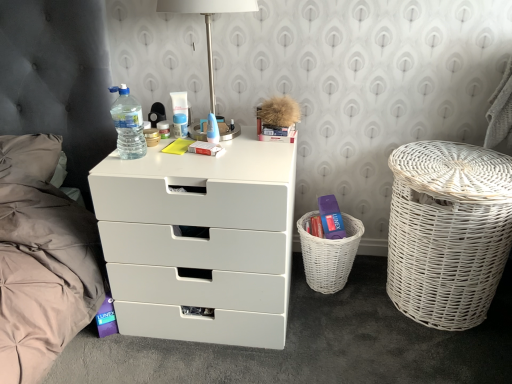
I want to click on white wicker basket at lower right, so click(x=329, y=254).

What do you see at coordinates (40, 263) in the screenshot?
I see `dark grey tufted headboard at left` at bounding box center [40, 263].

The height and width of the screenshot is (384, 512). What do you see at coordinates (448, 231) in the screenshot?
I see `white wicker laundry basket at right` at bounding box center [448, 231].

The height and width of the screenshot is (384, 512). Find the location of `translucent plastic tube at center, which is the third toiletry in right-to-left order`. translucent plastic tube at center, which is the third toiletry in right-to-left order is located at coordinates (164, 129).

Is point (187, 135) farther from viewer compared to point (455, 186)?

That is True.

Would you say white wicker laundry basket at right is part of blue plastic container at center, arranged as the third toiletry when viewed from the left,'s contents?

That's incorrect, white wicker laundry basket at right is not inside blue plastic container at center, arranged as the third toiletry when viewed from the left.

Which object is thinner, blue plastic container at center, arranged as the third toiletry when viewed from the left, or white wicker laundry basket at right?

blue plastic container at center, arranged as the third toiletry when viewed from the left, is thinner.

Is blue plastic container at center, the 1th toiletry when ordered from right to left, in contact with white wicker laundry basket at right?

There is a gap between blue plastic container at center, the 1th toiletry when ordered from right to left, and white wicker laundry basket at right.

Looking at this image, from a real-world perspective, between translucent plastic tube at center, the first toiletry in the left-to-right sequence, and dark grey tufted headboard at left, who is vertically higher?

translucent plastic tube at center, the first toiletry in the left-to-right sequence.

Is translucent plastic tube at center, which is the third toiletry in right-to-left order, not within dark grey tufted headboard at left?

Yes.

Is translucent plastic tube at center, which is the third toiletry in right-to-left order, looking in the opposite direction of dark grey tufted headboard at left?

No, dark grey tufted headboard at left is not at the back of translucent plastic tube at center, which is the third toiletry in right-to-left order.

Can you confirm if translucent plastic tube at center, which is the third toiletry in right-to-left order, is positioned to the left of dark grey tufted headboard at left?

Incorrect, translucent plastic tube at center, which is the third toiletry in right-to-left order, is not on the left side of dark grey tufted headboard at left.

Based on their sizes in the image, would you say satin nickel table lamp at upper center is bigger or smaller than blue plastic container at center, the 1th toiletry when ordered from right to left?

In the image, satin nickel table lamp at upper center appears to be larger than blue plastic container at center, the 1th toiletry when ordered from right to left.

Who is taller, satin nickel table lamp at upper center or blue plastic container at center, the 1th toiletry when ordered from right to left?

Standing taller between the two is satin nickel table lamp at upper center.

In terms of width, does satin nickel table lamp at upper center look wider or thinner when compared to blue plastic container at center, arranged as the third toiletry when viewed from the left?

In the image, satin nickel table lamp at upper center appears to be wider than blue plastic container at center, arranged as the third toiletry when viewed from the left.

Is satin nickel table lamp at upper center further to the viewer compared to translucent plastic bottle at upper left?

No.

Is satin nickel table lamp at upper center far away from translucent plastic bottle at upper left?

Actually, satin nickel table lamp at upper center and translucent plastic bottle at upper left are a little close together.

Is point (211, 66) positioned before point (132, 114)?

Yes, it is in front of point (132, 114).

Does satin nickel table lamp at upper center have a greater height compared to translucent plastic bottle at upper left?

Indeed, satin nickel table lamp at upper center has a greater height compared to translucent plastic bottle at upper left.

In the scene shown: Who is bigger, translucent plastic cream at center, acting as the second toiletry starting from the left, or blue plastic container at center, the 1th toiletry when ordered from right to left?

translucent plastic cream at center, acting as the second toiletry starting from the left.

Can you confirm if translucent plastic cream at center, which is counted as the second toiletry, starting from the right, is taller than blue plastic container at center, the 1th toiletry when ordered from right to left?

Indeed, translucent plastic cream at center, which is counted as the second toiletry, starting from the right, has a greater height compared to blue plastic container at center, the 1th toiletry when ordered from right to left.

Which point is more forward, (179, 102) or (180, 119)?

The point (180, 119) is closer to the camera.

Is white wicker basket at lower right not near white matte chest of drawers at center?

No.

From a real-world perspective, which object rests below the other?

From a 3D spatial view, white wicker basket at lower right is below.

Is white wicker basket at lower right bigger or smaller than white matte chest of drawers at center?

white wicker basket at lower right is smaller than white matte chest of drawers at center.

Is dark grey tufted headboard at left taller than translucent plastic cream at center, acting as the second toiletry starting from the left?

Yes, dark grey tufted headboard at left is taller than translucent plastic cream at center, acting as the second toiletry starting from the left.

Considering the sizes of dark grey tufted headboard at left and translucent plastic cream at center, which is counted as the second toiletry, starting from the right, in the image, is dark grey tufted headboard at left wider or thinner than translucent plastic cream at center, which is counted as the second toiletry, starting from the right,?

Clearly, dark grey tufted headboard at left has more width compared to translucent plastic cream at center, which is counted as the second toiletry, starting from the right.

Is dark grey tufted headboard at left behind translucent plastic cream at center, which is counted as the second toiletry, starting from the right?

No, dark grey tufted headboard at left is closer to the viewer.

Is point (32, 260) positioned in front of point (179, 113)?

Yes.

I want to click on toiletry that is the 2nd object located above the white wicker laundry basket at right (from the image's perspective), so click(x=180, y=125).

Image resolution: width=512 pixels, height=384 pixels. What are the coordinates of `bed frame lying on the left of translucent plastic tube at center, the first toiletry in the left-to-right sequence` in the screenshot? It's located at tap(40, 263).

Considering their positions, is white wicker basket at lower right positioned further to satin nickel table lamp at upper center than dark grey tufted headboard at left?

Among the two, white wicker basket at lower right is located further to satin nickel table lamp at upper center.

When comparing their distances from translucent plastic tube at center, the first toiletry in the left-to-right sequence, does translucent plastic cream at center, which is counted as the second toiletry, starting from the right, or blue plastic container at center, arranged as the third toiletry when viewed from the left, seem closer?

Based on the image, blue plastic container at center, arranged as the third toiletry when viewed from the left, appears to be nearer to translucent plastic tube at center, the first toiletry in the left-to-right sequence.

Estimate the real-world distances between objects in this image. Which object is further from white wicker laundry basket at right, white wicker basket at lower right or white matte chest of drawers at center?

white matte chest of drawers at center is positioned further to the anchor white wicker laundry basket at right.

Estimate the real-world distances between objects in this image. Which object is further from translucent plastic cream at center, which is counted as the second toiletry, starting from the right, translucent plastic bottle at upper left or white wicker laundry basket at right?

white wicker laundry basket at right is positioned further to the anchor translucent plastic cream at center, which is counted as the second toiletry, starting from the right.

Looking at the image, which one is located further to dark grey tufted headboard at left, translucent plastic bottle at upper left or translucent plastic tube at center, the first toiletry in the left-to-right sequence?

Among the two, translucent plastic tube at center, the first toiletry in the left-to-right sequence, is located further to dark grey tufted headboard at left.

When comparing their distances from blue plastic container at center, the 1th toiletry when ordered from right to left, does white wicker basket at lower right or white matte chest of drawers at center seem further?

white wicker basket at lower right is further to blue plastic container at center, the 1th toiletry when ordered from right to left.

When comparing their distances from dark grey tufted headboard at left, does translucent plastic tube at center, the first toiletry in the left-to-right sequence, or satin nickel table lamp at upper center seem closer?

The object closer to dark grey tufted headboard at left is translucent plastic tube at center, the first toiletry in the left-to-right sequence.

Which object lies nearer to the anchor point dark grey tufted headboard at left, white matte chest of drawers at center or satin nickel table lamp at upper center?

Based on the image, white matte chest of drawers at center appears to be nearer to dark grey tufted headboard at left.

Where is `basket situated between blue plastic container at center, arranged as the third toiletry when viewed from the left, and white wicker laundry basket at right from left to right`? The height and width of the screenshot is (384, 512). basket situated between blue plastic container at center, arranged as the third toiletry when viewed from the left, and white wicker laundry basket at right from left to right is located at coordinates (329, 254).

Where is `chest of drawers between translucent plastic cream at center, acting as the second toiletry starting from the left, and white wicker basket at lower right, in the horizontal direction`? chest of drawers between translucent plastic cream at center, acting as the second toiletry starting from the left, and white wicker basket at lower right, in the horizontal direction is located at coordinates (200, 241).

Find the location of a particular element. the chest of drawers located between translucent plastic cream at center, acting as the second toiletry starting from the left, and white wicker laundry basket at right in the left-right direction is located at coordinates (200, 241).

Locate an element on the screen. bottle between dark grey tufted headboard at left and white wicker basket at lower right from left to right is located at coordinates (128, 124).